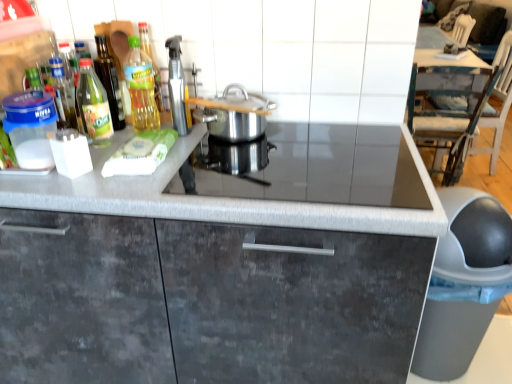
Locate an element on the screen. silver metallic spray bottle at upper center, the 2th kitchen appliance from the right is located at coordinates pos(177,88).

The width and height of the screenshot is (512, 384). In order to click on black glass gas stove at center in this screenshot , I will do `click(329, 173)`.

I want to click on white wood chair at upper right, so click(x=453, y=132).

Based on the photo, is gray matte trash can at lower right not near polished stainless steel pot at center, acting as the fourth kitchen appliance starting from the left?

No, gray matte trash can at lower right is in close proximity to polished stainless steel pot at center, acting as the fourth kitchen appliance starting from the left.

From a real-world perspective, which object stands above the other?

polished stainless steel pot at center, acting as the 1th kitchen appliance starting from the right, is physically above.

Is gray matte trash can at lower right aimed at polished stainless steel pot at center, acting as the 1th kitchen appliance starting from the right?

No, gray matte trash can at lower right is not facing towards polished stainless steel pot at center, acting as the 1th kitchen appliance starting from the right.

Is green glass bottle at upper left, the third kitchen appliance when ordered from right to left, taller or shorter than black glass gas stove at center?

In the image, green glass bottle at upper left, the third kitchen appliance when ordered from right to left, appears to be taller than black glass gas stove at center.

Is green glass bottle at upper left, which ranks as the 2th kitchen appliance in left-to-right order, not close to black glass gas stove at center?

green glass bottle at upper left, which ranks as the 2th kitchen appliance in left-to-right order, is actually quite close to black glass gas stove at center.

Is green glass bottle at upper left, the third kitchen appliance when ordered from right to left, to the left or to the right of black glass gas stove at center in the image?

Clearly, green glass bottle at upper left, the third kitchen appliance when ordered from right to left, is on the left of black glass gas stove at center in the image.

Which object is further away from the camera taking this photo, green glass bottle at left, arranged as the fourth kitchen appliance when viewed from the right, or green glass bottle at upper left, which ranks as the 2th kitchen appliance in left-to-right order?

green glass bottle at upper left, which ranks as the 2th kitchen appliance in left-to-right order, is behind.

Is green glass bottle at left, arranged as the fourth kitchen appliance when viewed from the right, positioned far away from green glass bottle at upper left, the third kitchen appliance when ordered from right to left?

They are positioned close to each other.

Does point (103, 116) come farther from viewer compared to point (148, 98)?

That is False.

Measure the distance between green glass bottle at left, the first kitchen appliance viewed from the left, and green glass bottle at upper left, the third kitchen appliance when ordered from right to left.

They are 13.32 centimeters apart.

Where is `appliance on the right of black glass gas stove at center`? This screenshot has height=384, width=512. appliance on the right of black glass gas stove at center is located at coordinates (464, 283).

Is gray matte trash can at lower right taller than black glass gas stove at center?

Yes, gray matte trash can at lower right is taller than black glass gas stove at center.

Is gray matte trash can at lower right to the right of black glass gas stove at center from the viewer's perspective?

Yes, gray matte trash can at lower right is to the right of black glass gas stove at center.

From a real-world perspective, is gray matte trash can at lower right positioned over black glass gas stove at center based on gravity?

No, from a real-world perspective, gray matte trash can at lower right is not above black glass gas stove at center.

Can you see green glass bottle at left, arranged as the fourth kitchen appliance when viewed from the right, touching polished stainless steel pot at center, acting as the fourth kitchen appliance starting from the left?

There is a gap between green glass bottle at left, arranged as the fourth kitchen appliance when viewed from the right, and polished stainless steel pot at center, acting as the fourth kitchen appliance starting from the left.

Identify the location of the 1st kitchen appliance located above the polished stainless steel pot at center, acting as the 1th kitchen appliance starting from the right (from a real-world perspective). (92, 106).

Is polished stainless steel pot at center, acting as the 1th kitchen appliance starting from the right, at the back of green glass bottle at left, arranged as the fourth kitchen appliance when viewed from the right?

No.

In the scene shown: From a real-world perspective, which object stands above the other?

green glass bottle at left, the first kitchen appliance viewed from the left.

How different are the orientations of white wood chair at upper right and polished stainless steel pot at center, acting as the 1th kitchen appliance starting from the right, in degrees?

They differ by 87.5 degrees in their facing directions.

Can you see white wood chair at upper right touching polished stainless steel pot at center, acting as the 1th kitchen appliance starting from the right?

No, white wood chair at upper right is not next to polished stainless steel pot at center, acting as the 1th kitchen appliance starting from the right.

Visually, is white wood chair at upper right positioned to the left or to the right of polished stainless steel pot at center, acting as the 1th kitchen appliance starting from the right?

From the image, it's evident that white wood chair at upper right is to the right of polished stainless steel pot at center, acting as the 1th kitchen appliance starting from the right.

Based on their sizes in the image, would you say white wood chair at upper right is bigger or smaller than polished stainless steel pot at center, acting as the 1th kitchen appliance starting from the right?

Considering their sizes, white wood chair at upper right takes up more space than polished stainless steel pot at center, acting as the 1th kitchen appliance starting from the right.

Could you tell me if gray matte trash can at lower right is facing white wood chair at upper right?

No, gray matte trash can at lower right does not turn towards white wood chair at upper right.

Consider the image. From a real-world perspective, is gray matte trash can at lower right physically above white wood chair at upper right?

Incorrect, from a real-world perspective, gray matte trash can at lower right is lower than white wood chair at upper right.

Is gray matte trash can at lower right closer to camera compared to white wood chair at upper right?

Yes, it is in front of white wood chair at upper right.

Locate an element on the screen. This screenshot has height=384, width=512. appliance below the polished stainless steel pot at center, acting as the fourth kitchen appliance starting from the left (from a real-world perspective) is located at coordinates (464, 283).

This screenshot has height=384, width=512. I want to click on the 3rd kitchen appliance to the left of the black glass gas stove at center, starting your count from the anchor, so click(141, 87).

Considering their positions, is gray matte trash can at lower right positioned closer to matte gray cabinet at center than silver metallic spray bottle at upper center, placed as the 3th kitchen appliance when sorted from left to right?

silver metallic spray bottle at upper center, placed as the 3th kitchen appliance when sorted from left to right, is positioned closer to the anchor matte gray cabinet at center.

Considering their positions, is silver metallic spray bottle at upper center, placed as the 3th kitchen appliance when sorted from left to right, positioned further to gray matte trash can at lower right than black glass gas stove at center?

silver metallic spray bottle at upper center, placed as the 3th kitchen appliance when sorted from left to right.

From the image, which object appears to be nearer to gray matte trash can at lower right, green glass bottle at left, arranged as the fourth kitchen appliance when viewed from the right, or white wood chair at upper right?

Based on the image, green glass bottle at left, arranged as the fourth kitchen appliance when viewed from the right, appears to be nearer to gray matte trash can at lower right.

Which object lies nearer to the anchor point silver metallic spray bottle at upper center, placed as the 3th kitchen appliance when sorted from left to right, polished stainless steel pot at center, acting as the 1th kitchen appliance starting from the right, or black glass gas stove at center?

Among the two, polished stainless steel pot at center, acting as the 1th kitchen appliance starting from the right, is located nearer to silver metallic spray bottle at upper center, placed as the 3th kitchen appliance when sorted from left to right.

When comparing their distances from silver metallic spray bottle at upper center, the 2th kitchen appliance from the right, does green glass bottle at upper left, which ranks as the 2th kitchen appliance in left-to-right order, or gray matte trash can at lower right seem further?

Based on the image, gray matte trash can at lower right appears to be further to silver metallic spray bottle at upper center, the 2th kitchen appliance from the right.

Considering their positions, is matte gray cabinet at center positioned closer to black glass gas stove at center than polished stainless steel pot at center, acting as the fourth kitchen appliance starting from the left?

polished stainless steel pot at center, acting as the fourth kitchen appliance starting from the left, is positioned closer to the anchor black glass gas stove at center.

Considering their positions, is polished stainless steel pot at center, acting as the 1th kitchen appliance starting from the right, positioned further to black glass gas stove at center than gray matte trash can at lower right?

The object further to black glass gas stove at center is gray matte trash can at lower right.

Based on their spatial positions, is black glass gas stove at center or gray matte trash can at lower right further from silver metallic spray bottle at upper center, the 2th kitchen appliance from the right?

Among the two, gray matte trash can at lower right is located further to silver metallic spray bottle at upper center, the 2th kitchen appliance from the right.

Where is `gas stove between matte gray cabinet at center and white wood chair at upper right in the front-back direction`? The image size is (512, 384). gas stove between matte gray cabinet at center and white wood chair at upper right in the front-back direction is located at coordinates click(x=329, y=173).

Find the location of `kitchen appliance situated between matte gray cabinet at center and white wood chair at upper right from left to right`. kitchen appliance situated between matte gray cabinet at center and white wood chair at upper right from left to right is located at coordinates (234, 114).

Find the location of a particular element. The height and width of the screenshot is (384, 512). appliance situated between silver metallic spray bottle at upper center, the 2th kitchen appliance from the right, and white wood chair at upper right from left to right is located at coordinates (464, 283).

At what (x,y) coordinates should I click in order to perform the action: click on gas stove that lies between green glass bottle at upper left, the third kitchen appliance when ordered from right to left, and matte gray cabinet at center from top to bottom. Please return your answer as a coordinate pair (x, y). Looking at the image, I should click on (329, 173).